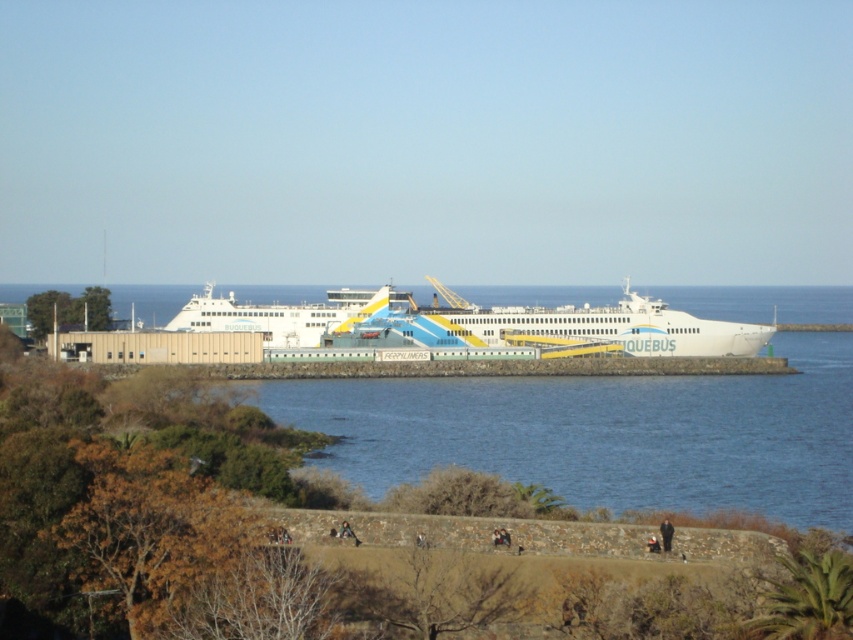
Question: Which point is closer to the camera taking this photo?

Choices:
 (A) (291, 326)
 (B) (666, 552)

Answer: (B)

Question: Is white glossy ferry at center to the left of black fabric person at lower right from the viewer's perspective?

Choices:
 (A) no
 (B) yes

Answer: (B)

Question: Does white glossy ferry at center have a larger size compared to black fabric person at lower right?

Choices:
 (A) yes
 (B) no

Answer: (A)

Question: Which point is farther to the camera?

Choices:
 (A) (671, 532)
 (B) (556, 337)

Answer: (B)

Question: Which of the following is the closest to the observer?

Choices:
 (A) white glossy ferry at center
 (B) black fabric person at lower right

Answer: (B)

Question: Is white glossy ferry at center further to camera compared to black fabric person at lower right?

Choices:
 (A) no
 (B) yes

Answer: (B)